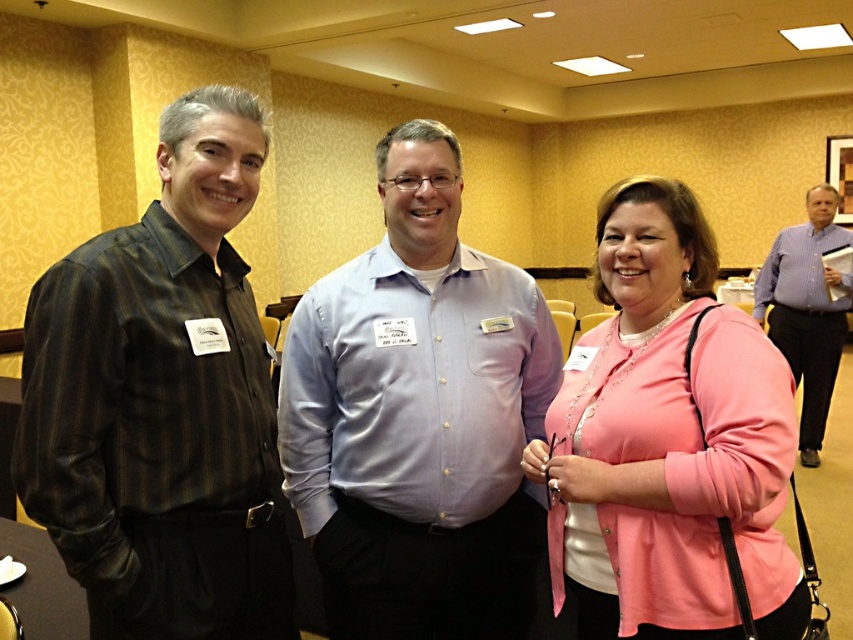
Question: Is light blue button-down shirt at center positioned in front of pink satin blouse at center?

Choices:
 (A) yes
 (B) no

Answer: (B)

Question: Which object appears farthest from the camera in this image?

Choices:
 (A) pink satin blouse at center
 (B) blue button-down shirt at right
 (C) matte black shirt at left
 (D) light blue button-down shirt at center

Answer: (B)

Question: Considering the relative positions of light blue button-down shirt at center and pink satin blouse at center in the image provided, where is light blue button-down shirt at center located with respect to pink satin blouse at center?

Choices:
 (A) below
 (B) above

Answer: (B)

Question: Considering the real-world distances, which object is farthest from the pink satin blouse at center?

Choices:
 (A) blue button-down shirt at right
 (B) matte black shirt at left
 (C) light blue button-down shirt at center

Answer: (A)

Question: Does matte black shirt at left have a greater width compared to pink satin blouse at center?

Choices:
 (A) yes
 (B) no

Answer: (B)

Question: Which of the following is the closest to the observer?

Choices:
 (A) coord(851,234)
 (B) coord(38,387)

Answer: (B)